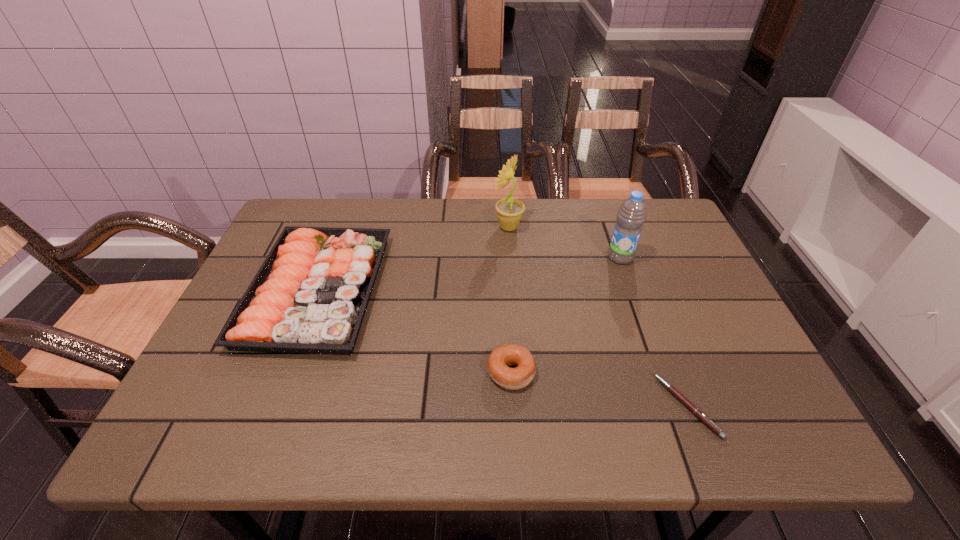
The image size is (960, 540). What are the coordinates of `free region located on the back of the platter` in the screenshot? It's located at (343, 225).

Find the location of a particular element. Image resolution: width=960 pixels, height=540 pixels. free spot located 0.310m on the right of the bagel is located at coordinates (681, 372).

Where is `vacant area situated 0.220m at the nib of the shortest object`? vacant area situated 0.220m at the nib of the shortest object is located at coordinates (553, 406).

Find the location of a particular element. Image resolution: width=960 pixels, height=540 pixels. vacant space located at the nib of the shortest object is located at coordinates (593, 406).

You are a GUI agent. You are given a task and a screenshot of the screen. Output one action in this format:
    pyautogui.click(x=<x>, y=<y>)
    Task: Click on the free space located 0.330m at the nib of the shortest object
    The height and width of the screenshot is (540, 960).
    Given the screenshot: What is the action you would take?
    pyautogui.click(x=498, y=406)

This screenshot has height=540, width=960. Find the location of `sunflower at the far edge`. sunflower at the far edge is located at coordinates (509, 211).

Locate an element on the screen. This screenshot has height=540, width=960. platter present at the far edge is located at coordinates (310, 295).

I want to click on object located at the near edge, so 697,412.

Identify the location of object that is at the left edge. pos(310,295).

At what (x,y) coordinates should I click in order to perform the action: click on object located at the right edge. Please return your answer as a coordinate pair (x, y). Looking at the image, I should click on (697, 412).